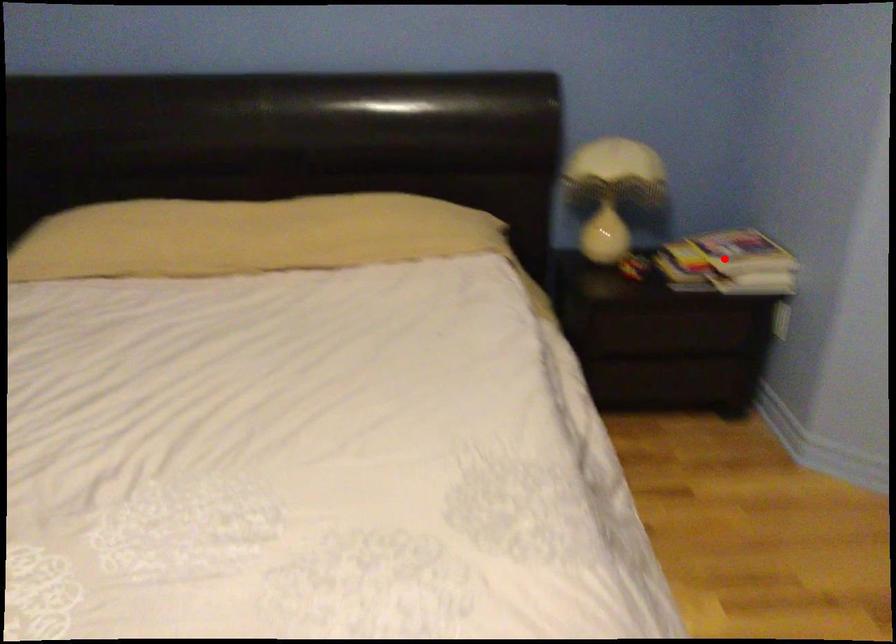
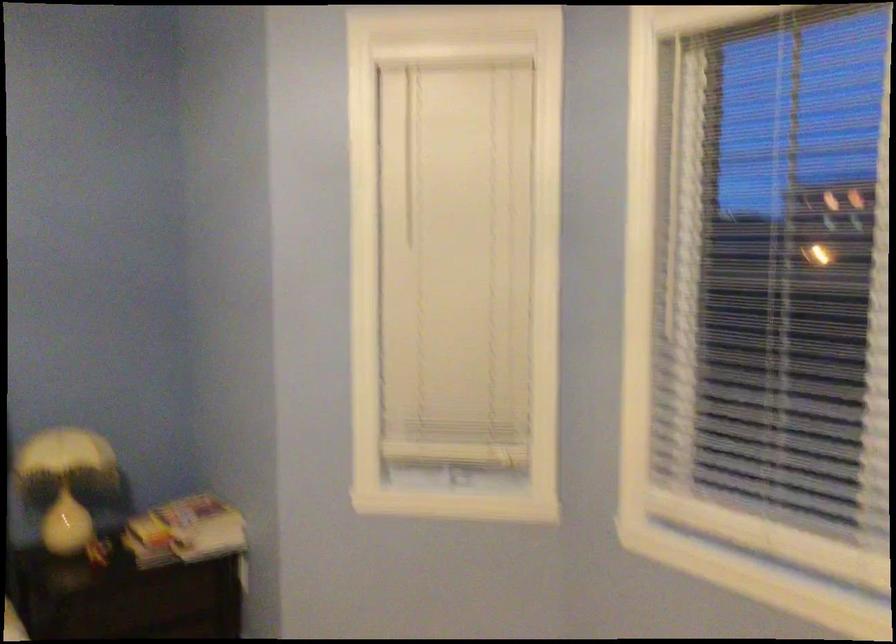
Locate, in the second image, the point that corresponds to the highlighted location in the first image.

(185, 532)